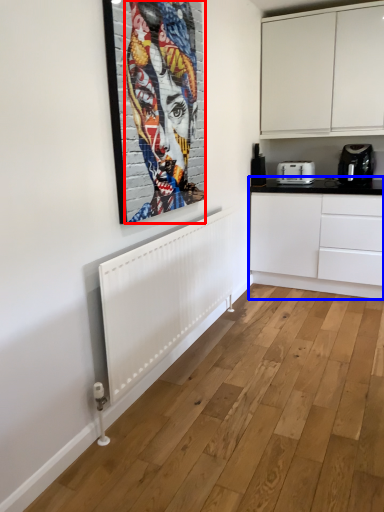
Question: Among these objects, which one is farthest to the camera, person (highlighted by a red box) or counter top (highlighted by a blue box)?

Choices:
 (A) person
 (B) counter top

Answer: (B)